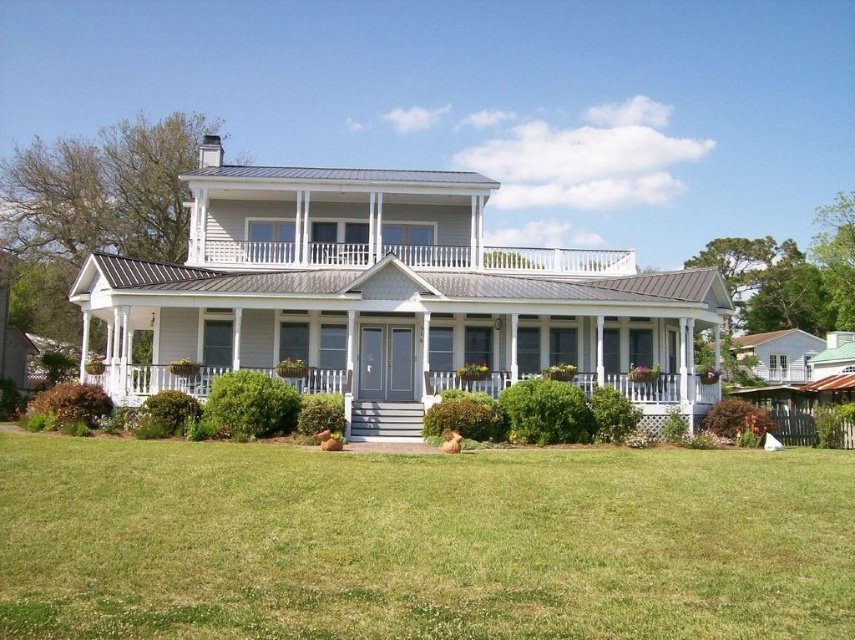
Is point (154, 611) in front of point (445, 252)?

Yes, point (154, 611) is in front of point (445, 252).

Where is `green grass at center`? The image size is (855, 640). green grass at center is located at coordinates (420, 541).

Measure the distance between point (x=84, y=509) and camera.

Point (x=84, y=509) and camera are 10.85 meters apart from each other.

I want to click on green grass at center, so click(420, 541).